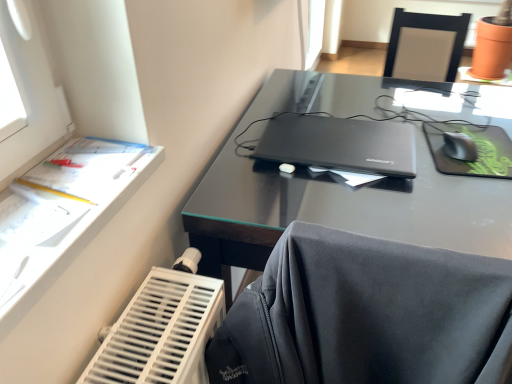
Question: Is black plastic mouse at right facing away from black matte mouse pad at right?

Choices:
 (A) yes
 (B) no

Answer: (A)

Question: Does black plastic mouse at right have a lesser height compared to black matte mouse pad at right?

Choices:
 (A) no
 (B) yes

Answer: (A)

Question: Can you confirm if black plastic mouse at right is bigger than black matte mouse pad at right?

Choices:
 (A) no
 (B) yes

Answer: (A)

Question: Considering the relative sizes of black plastic mouse at right and black matte mouse pad at right in the image provided, is black plastic mouse at right thinner than black matte mouse pad at right?

Choices:
 (A) no
 (B) yes

Answer: (B)

Question: Is black plastic mouse at right far from black matte mouse pad at right?

Choices:
 (A) yes
 (B) no

Answer: (B)

Question: Considering the relative sizes of black plastic mouse at right and black matte mouse pad at right in the image provided, is black plastic mouse at right taller than black matte mouse pad at right?

Choices:
 (A) yes
 (B) no

Answer: (A)

Question: Is black matte mouse pad at right at the left side of matte black laptop at center?

Choices:
 (A) no
 (B) yes

Answer: (A)

Question: From a real-world perspective, is black matte mouse pad at right beneath matte black laptop at center?

Choices:
 (A) no
 (B) yes

Answer: (B)

Question: Is black matte mouse pad at right looking in the opposite direction of matte black laptop at center?

Choices:
 (A) no
 (B) yes

Answer: (A)

Question: Is matte black laptop at center a part of black matte mouse pad at right?

Choices:
 (A) yes
 (B) no

Answer: (B)

Question: Is black matte mouse pad at right not inside matte black laptop at center?

Choices:
 (A) yes
 (B) no

Answer: (A)

Question: Considering the relative sizes of black matte mouse pad at right and matte black laptop at center in the image provided, is black matte mouse pad at right taller than matte black laptop at center?

Choices:
 (A) no
 (B) yes

Answer: (A)

Question: Does matte black laptop at center lie in front of white paper at left?

Choices:
 (A) no
 (B) yes

Answer: (A)